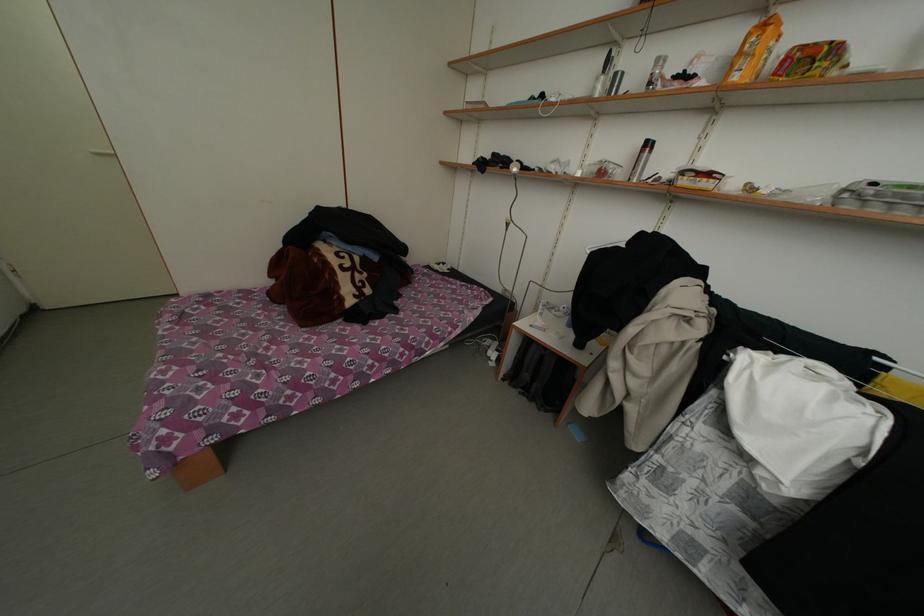
What are the coordinates of `colorful food box` in the screenshot? It's located at (811, 61).